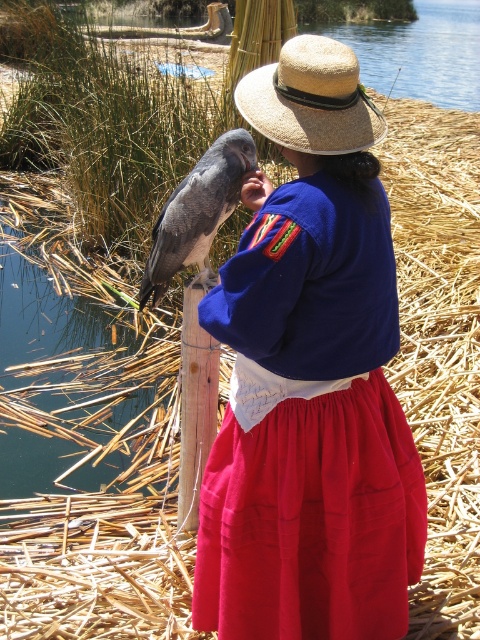
You are designing a storage box to fit both the matte straw hat at center and the wooden post at center. Which object requires a wider base for the box?

The matte straw hat at center might be wider than wooden post at center, so the box requires a wider base to accommodate the matte straw hat at center.

You are standing at the point with coordinates point (x=247, y=145) and want to move to the point with coordinates point (x=277, y=109). Which direction should you move to get closer to the viewer?

To move from point (x=247, y=145) to point (x=277, y=109), you should move towards the direction of the viewer since point (x=277, y=109) is closer to the viewer than point (x=247, y=145).